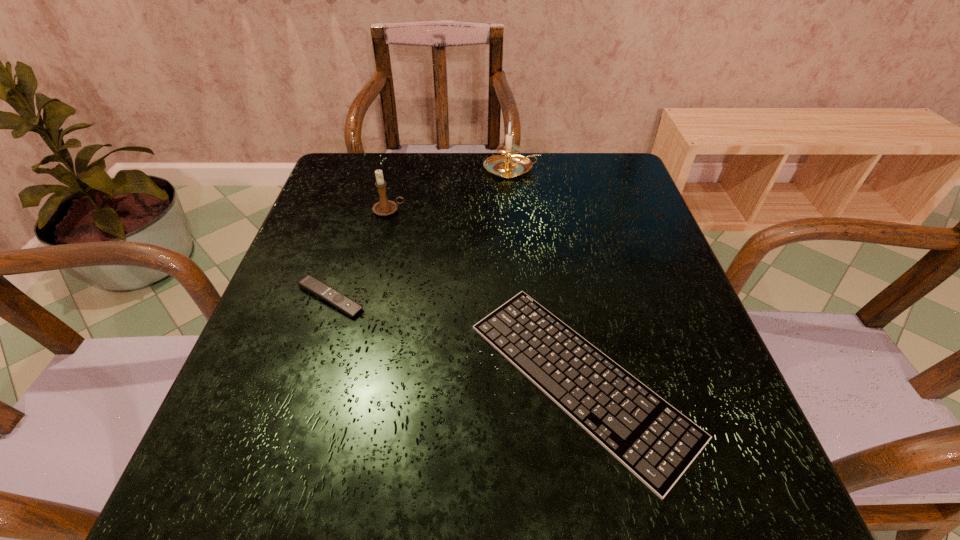
I want to click on free space in the image that satisfies the following two spatial constraints: 1. on the side of the nearer candle holder with the handle; 2. on the left side of the computer keyboard, so click(x=348, y=379).

Identify the location of free space in the image that satisfies the following two spatial constraints: 1. on the handle side of the computer keyboard; 2. on the left side of the farthest object. This screenshot has width=960, height=540. (531, 379).

Find the location of a particular element. free space in the image that satisfies the following two spatial constraints: 1. on the side of the shorter candle holder with the handle; 2. on the front side of the remote control is located at coordinates (368, 298).

Where is `free location that satisfies the following two spatial constraints: 1. on the handle side of the computer keyboard; 2. on the left side of the taller candle holder`? Image resolution: width=960 pixels, height=540 pixels. free location that satisfies the following two spatial constraints: 1. on the handle side of the computer keyboard; 2. on the left side of the taller candle holder is located at coordinates (531, 379).

Where is `vacant area that satisfies the following two spatial constraints: 1. on the handle side of the right candle holder; 2. on the left side of the computer keyboard`? This screenshot has height=540, width=960. vacant area that satisfies the following two spatial constraints: 1. on the handle side of the right candle holder; 2. on the left side of the computer keyboard is located at coordinates (531, 379).